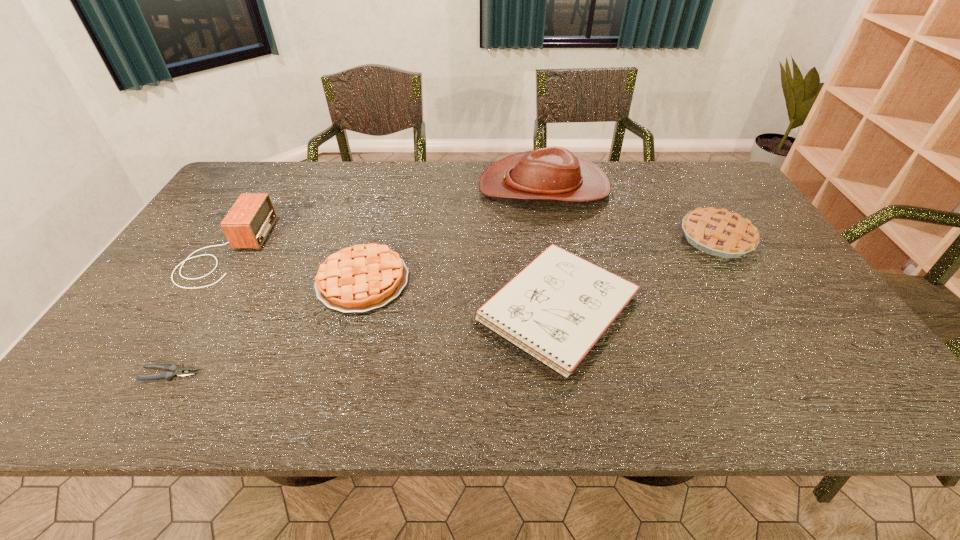
Identify the location of free space that satisfies the following two spatial constraints: 1. on the front side of the notepad; 2. at the gripping part of the pliers. The width and height of the screenshot is (960, 540). (568, 374).

Locate an element on the screen. This screenshot has width=960, height=540. free space that satisfies the following two spatial constraints: 1. on the back side of the rightmost object; 2. on the right side of the notepad is located at coordinates (545, 238).

Locate an element on the screen. Image resolution: width=960 pixels, height=540 pixels. free spot that satisfies the following two spatial constraints: 1. on the front-facing side of the farthest object; 2. on the right side of the rightmost object is located at coordinates (554, 238).